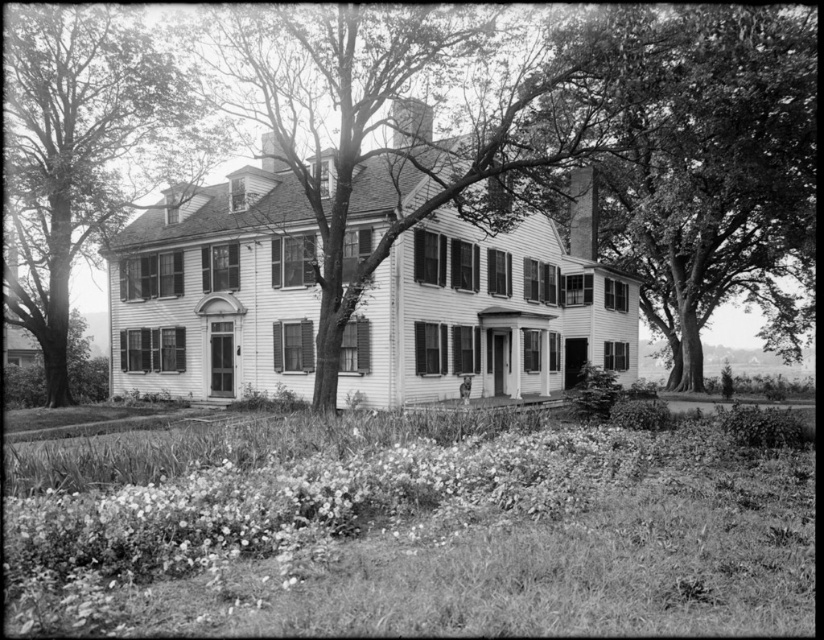
Looking at this image, between smooth bark tree at center and smooth bark tree at left, which one has less height?

smooth bark tree at left is shorter.

The height and width of the screenshot is (640, 824). Describe the element at coordinates (420, 115) in the screenshot. I see `smooth bark tree at center` at that location.

I want to click on smooth bark tree at center, so click(x=420, y=115).